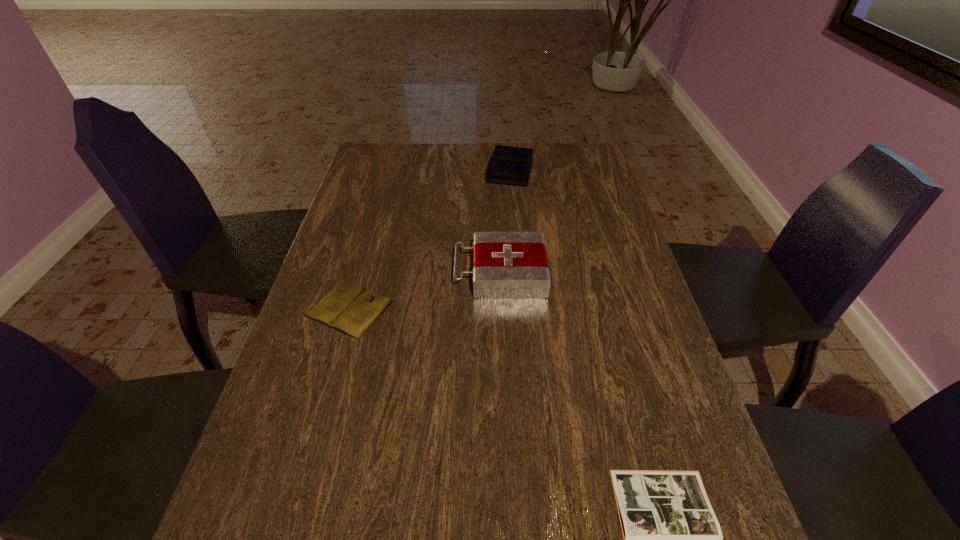
This screenshot has width=960, height=540. What are the coordinates of `empty location between the first-aid kit and the farthest object` in the screenshot? It's located at (505, 222).

You are a GUI agent. You are given a task and a screenshot of the screen. Output one action in this format:
    pyautogui.click(x=<x>, y=<y>)
    Task: Click on the third closest object to the tallest book
    The image size is (960, 540).
    Given the screenshot: What is the action you would take?
    pyautogui.click(x=672, y=539)

Where is `object that is the closest to the third shortest object`? object that is the closest to the third shortest object is located at coordinates pos(506,265).

Locate an element on the screen. book identified as the second closest to the third shortest object is located at coordinates (672, 539).

Select which book appears as the closest to the farthest object. Please provide its 2D coordinates. Your answer should be formatted as a tuple, i.e. [(x, y)], where the tuple contains the x and y coordinates of a point satisfying the conditions above.

[(349, 308)]